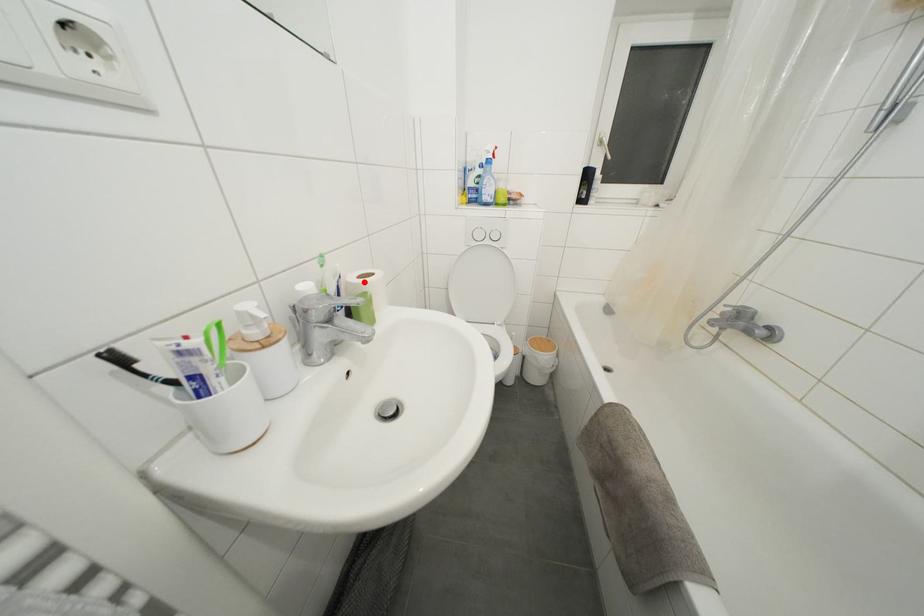
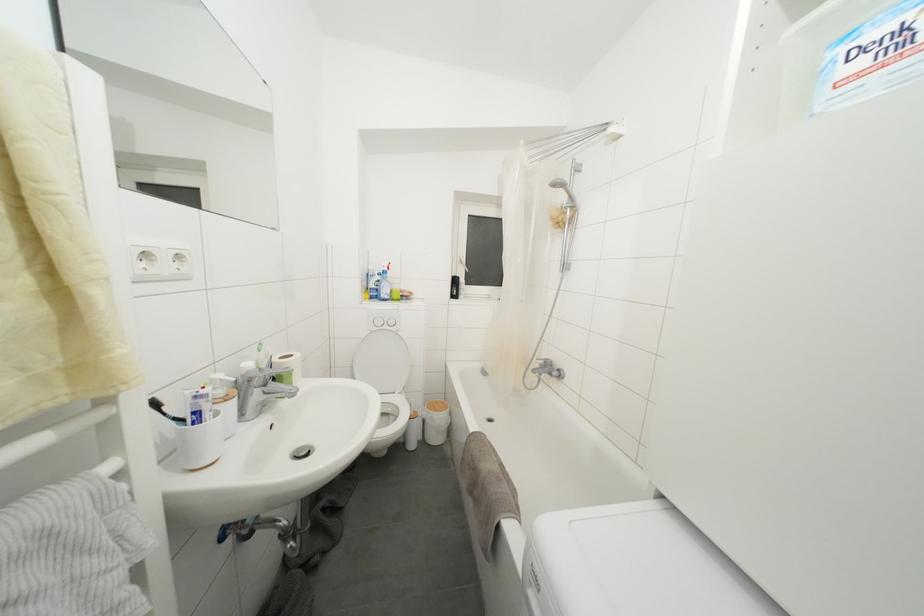
Locate, in the second image, the point that corresponds to the highlighted location in the first image.

(285, 363)